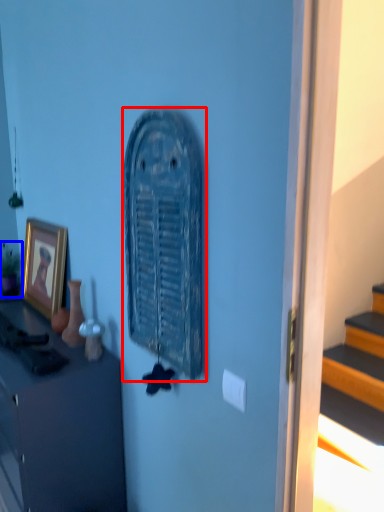
Question: Which object is further to the camera taking this photo, art (highlighted by a red box) or houseplant (highlighted by a blue box)?

Choices:
 (A) art
 (B) houseplant

Answer: (B)